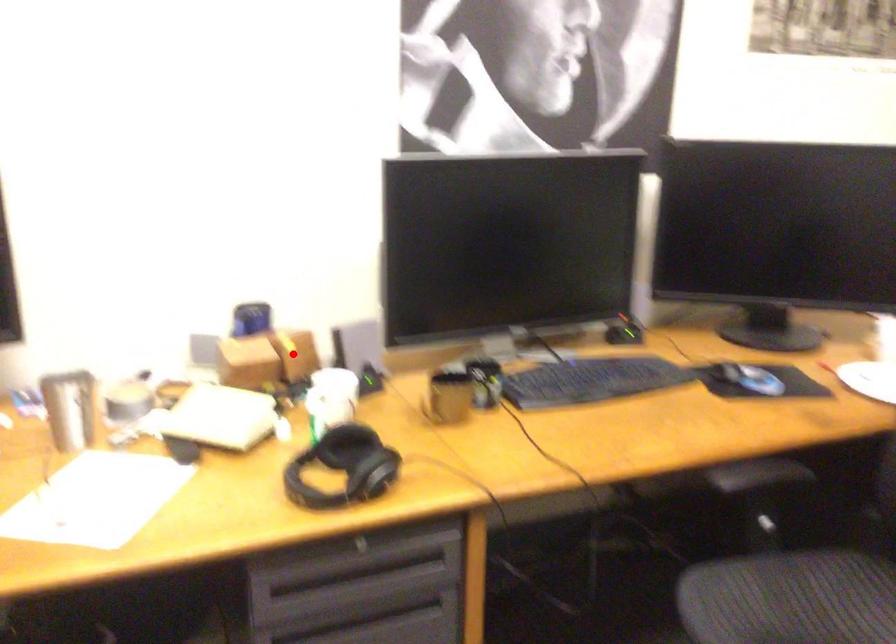
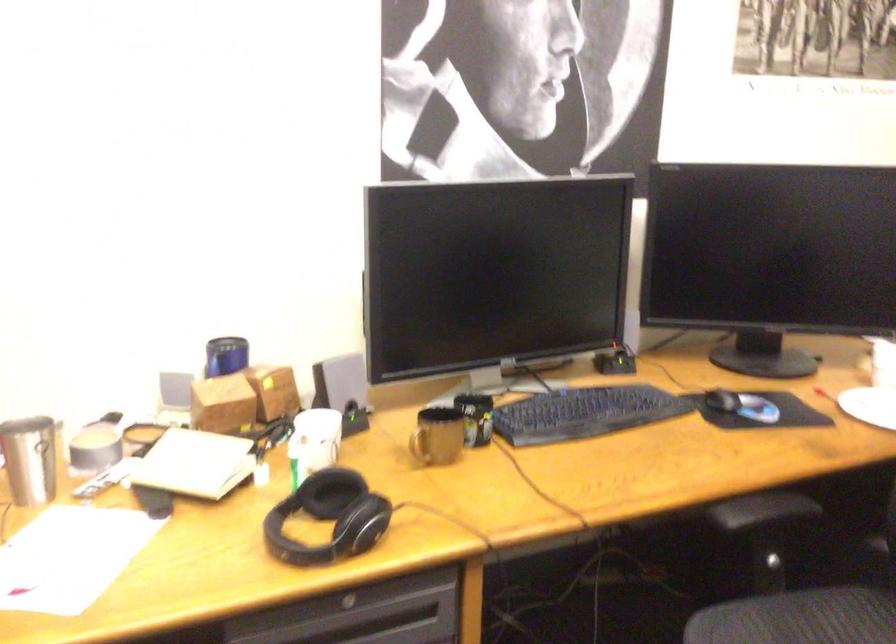
Locate, in the second image, the point that corresponds to the highlighted location in the first image.

(272, 392)